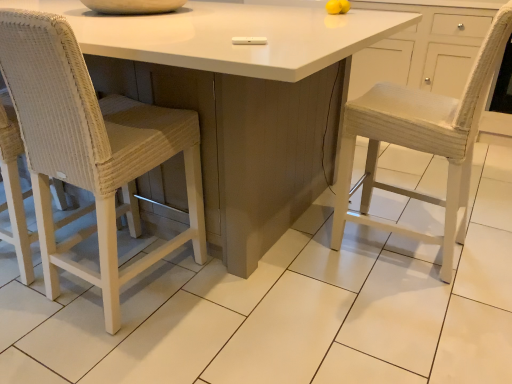
Question: Is woven wicker chair at left beside white glossy table at center?

Choices:
 (A) no
 (B) yes

Answer: (A)

Question: Is woven wicker chair at left smaller than white glossy table at center?

Choices:
 (A) yes
 (B) no

Answer: (A)

Question: From the image's perspective, is woven wicker chair at left on top of white glossy table at center?

Choices:
 (A) yes
 (B) no

Answer: (B)

Question: Is woven wicker chair at left shorter than white glossy table at center?

Choices:
 (A) yes
 (B) no

Answer: (B)

Question: Can you confirm if woven wicker chair at left is positioned to the left of white glossy table at center?

Choices:
 (A) no
 (B) yes

Answer: (A)

Question: Is woven wicker chair at left positioned with its back to white glossy table at center?

Choices:
 (A) yes
 (B) no

Answer: (A)

Question: From a real-world perspective, is white glossy table at center physically above woven wicker chair at left?

Choices:
 (A) no
 (B) yes

Answer: (A)

Question: Is white glossy table at center with woven wicker chair at left?

Choices:
 (A) no
 (B) yes

Answer: (A)

Question: Can you confirm if white glossy table at center is wider than woven wicker chair at left?

Choices:
 (A) yes
 (B) no

Answer: (A)

Question: Does white glossy table at center come behind woven wicker chair at left?

Choices:
 (A) no
 (B) yes

Answer: (A)

Question: Is white glossy table at center oriented away from woven wicker chair at left?

Choices:
 (A) yes
 (B) no

Answer: (A)

Question: Considering the relative positions of white glossy table at center and woven wicker chair at left in the image provided, is white glossy table at center to the left of woven wicker chair at left from the viewer's perspective?

Choices:
 (A) yes
 (B) no

Answer: (A)

Question: Is point (23, 82) positioned closer to the camera than point (177, 21)?

Choices:
 (A) closer
 (B) farther

Answer: (A)